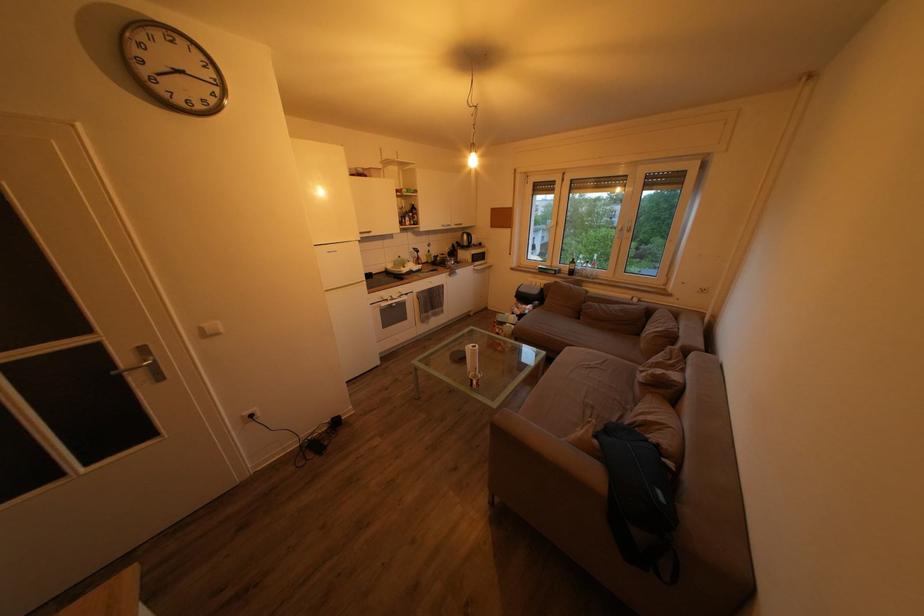
Where is `silver door handle`? This screenshot has height=616, width=924. silver door handle is located at coordinates (143, 363).